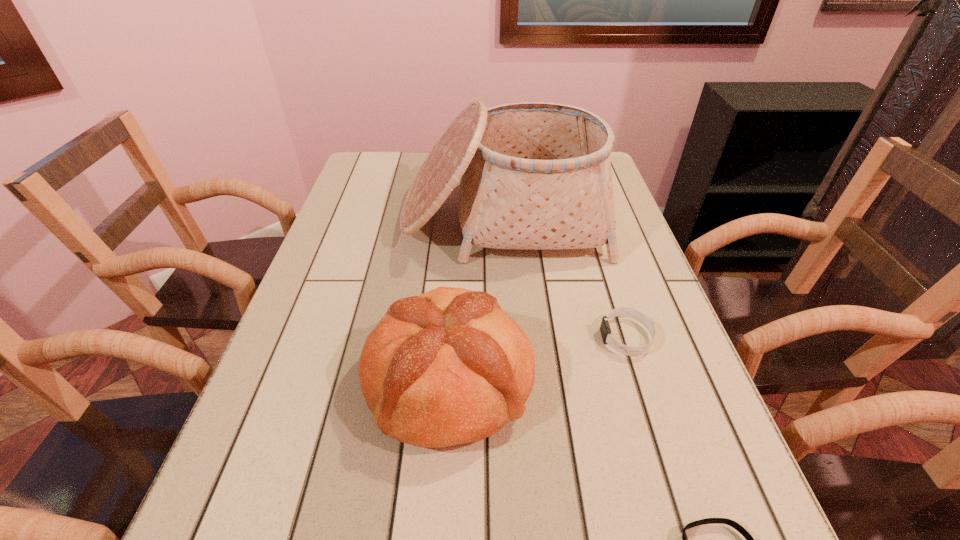
Locate an element on the screen. This screenshot has width=960, height=540. basket is located at coordinates (534, 175).

Locate an element on the screen. the tallest object is located at coordinates (534, 175).

This screenshot has height=540, width=960. I want to click on bread, so click(x=447, y=367).

Find the location of a particular element. The image size is (960, 540). the taller wristband is located at coordinates (605, 330).

Identify the location of the farther wristband. The image size is (960, 540). (605, 330).

Locate an element on the screen. This screenshot has width=960, height=540. free space located 0.360m with the lid open on the farthest object is located at coordinates (515, 395).

At what (x,y) coordinates should I click in order to perform the action: click on blank space located 0.060m on the back of the third shortest object. Please return your answer as a coordinate pair (x, y). This screenshot has width=960, height=540. Looking at the image, I should click on (454, 299).

Identify the location of vacant space situated on the outer surface of the taller wristband. (484, 337).

Locate an element on the screen. The width and height of the screenshot is (960, 540). free point located 0.350m on the outer surface of the taller wristband is located at coordinates (430, 337).

Where is `vacant area situated 0.350m on the outer surface of the taller wristband`? vacant area situated 0.350m on the outer surface of the taller wristband is located at coordinates (430, 337).